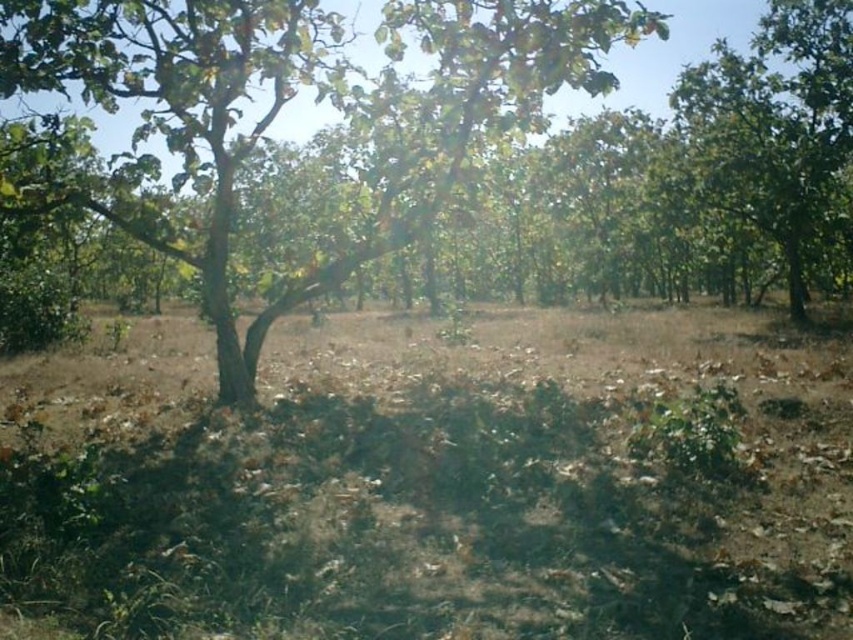
Question: Is brown dry dirt at center below green leafy tree at upper right?

Choices:
 (A) no
 (B) yes

Answer: (B)

Question: Among these points, which one is farthest from the camera?

Choices:
 (A) (223, 44)
 (B) (820, 179)

Answer: (B)

Question: Is the position of brown dry dirt at center less distant than that of green leafy tree at upper right?

Choices:
 (A) no
 (B) yes

Answer: (B)

Question: Considering the relative positions of brown dry dirt at center and green leafy tree at upper right in the image provided, where is brown dry dirt at center located with respect to green leafy tree at upper right?

Choices:
 (A) left
 (B) right

Answer: (A)

Question: Estimate the real-world distances between objects in this image. Which object is farther from the brown dry dirt at center?

Choices:
 (A) green leafy tree at center
 (B) green leafy tree at upper right

Answer: (B)

Question: Among these points, which one is farthest from the camera?

Choices:
 (A) (418, 173)
 (B) (167, 602)
 (C) (709, 182)

Answer: (C)